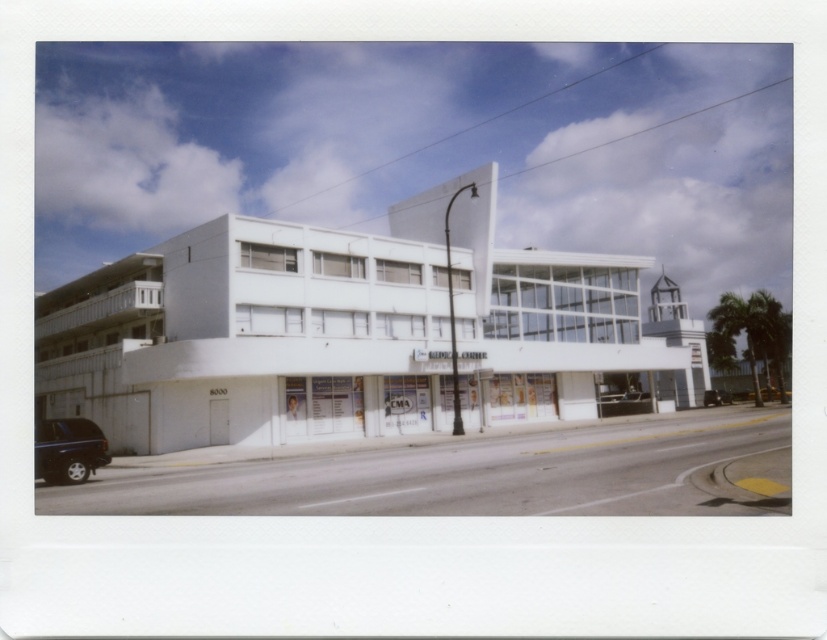
Question: Among these objects, which one is farthest from the camera?

Choices:
 (A) black rubber car at center
 (B) shiny black suv at lower left

Answer: (A)

Question: Is shiny black suv at lower left thinner than black rubber car at center?

Choices:
 (A) yes
 (B) no

Answer: (A)

Question: Is shiny black suv at lower left closer to the viewer compared to black rubber car at center?

Choices:
 (A) no
 (B) yes

Answer: (B)

Question: Is shiny black suv at lower left to the left of black rubber car at center from the viewer's perspective?

Choices:
 (A) no
 (B) yes

Answer: (B)

Question: Which point appears closest to the camera in this image?

Choices:
 (A) (708, 394)
 (B) (68, 442)

Answer: (B)